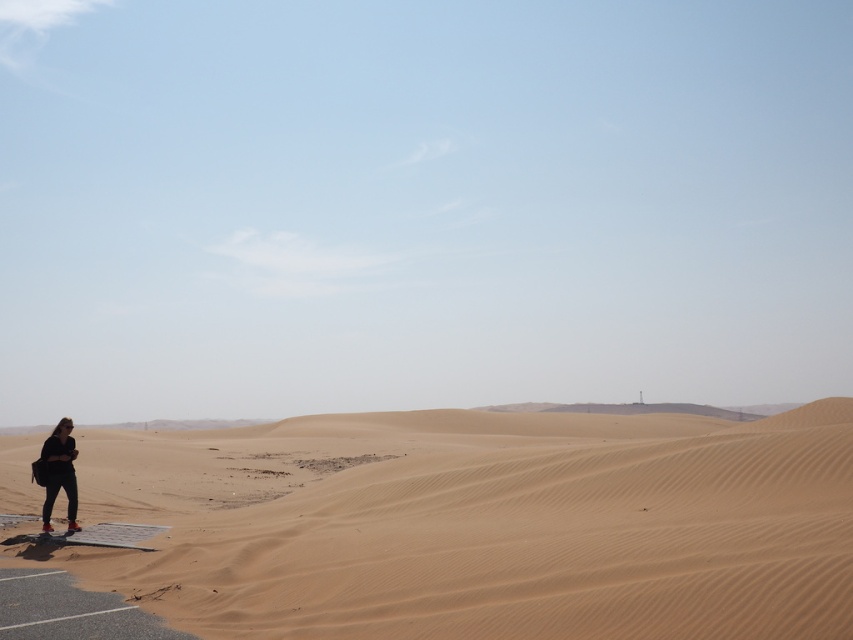
You are standing on the paved area in the desert and see two points marked in the image. Which point is closer to you, point [527,472] or point [56,492]?

Point [527,472] is closer to the viewer than point [56,492].

You are a hiker trying to reach the tower in the distance. You see the sandy beige dunes at lower left and the matte black jacket at lower left. Which object is closer to the ground?

The sandy beige dunes at lower left is below matte black jacket at lower left, so the sandy beige dunes at lower left is closer to the ground.

You are a photographer trying to capture the sandy beige dunes at lower left and the matte black jacket at lower left in the same frame. Given that your camera has a maximum focus range of 10 meters, will you be able to focus on both objects simultaneously?

The sandy beige dunes at lower left and the matte black jacket at lower left are 12.82 meters apart from each other. Since the distance between them exceeds the camera maximum focus range of 10 meters, the photographer cannot focus on both objects simultaneously.